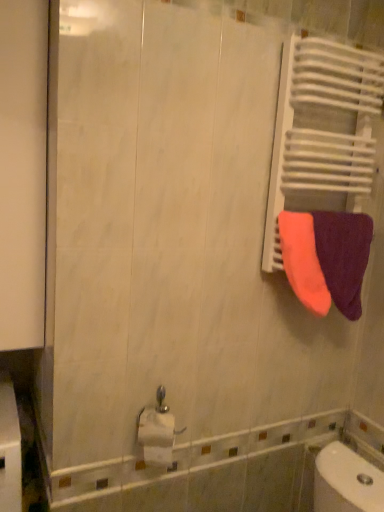
Question: Can you confirm if white glossy toilet paper at lower center is positioned to the right of neon orange fabric at right, which is the 1th towel in left-to-right order?

Choices:
 (A) no
 (B) yes

Answer: (A)

Question: Is white glossy toilet paper at lower center bigger than neon orange fabric at right, which is the 1th towel in left-to-right order?

Choices:
 (A) no
 (B) yes

Answer: (A)

Question: From the image's perspective, would you say white glossy toilet paper at lower center is shown under neon orange fabric at right, positioned as the second towel in right-to-left order?

Choices:
 (A) yes
 (B) no

Answer: (A)

Question: Is white glossy toilet paper at lower center taller than neon orange fabric at right, positioned as the second towel in right-to-left order?

Choices:
 (A) yes
 (B) no

Answer: (B)

Question: Is white glossy toilet paper at lower center positioned far away from neon orange fabric at right, which is the 1th towel in left-to-right order?

Choices:
 (A) yes
 (B) no

Answer: (B)

Question: Is orange terry cloth towel at right, which ranks as the 2th towel in left-to-right order, situated inside neon orange fabric at right, which is the 1th towel in left-to-right order, or outside?

Choices:
 (A) inside
 (B) outside

Answer: (B)

Question: Would you say orange terry cloth towel at right, which ranks as the 1th towel in right-to-left order, is to the left or to the right of neon orange fabric at right, positioned as the second towel in right-to-left order, in the picture?

Choices:
 (A) right
 (B) left

Answer: (A)

Question: Is point (332, 241) closer or farther from the camera than point (289, 230)?

Choices:
 (A) farther
 (B) closer

Answer: (A)

Question: In terms of height, does orange terry cloth towel at right, which ranks as the 2th towel in left-to-right order, look taller or shorter compared to neon orange fabric at right, which is the 1th towel in left-to-right order?

Choices:
 (A) short
 (B) tall

Answer: (B)

Question: Visually, is white glossy toilet paper at lower center positioned to the left or to the right of orange terry cloth towel at right, which ranks as the 2th towel in left-to-right order?

Choices:
 (A) right
 (B) left

Answer: (B)

Question: Considering the positions of white glossy toilet paper at lower center and orange terry cloth towel at right, which ranks as the 2th towel in left-to-right order, in the image, is white glossy toilet paper at lower center bigger or smaller than orange terry cloth towel at right, which ranks as the 2th towel in left-to-right order,?

Choices:
 (A) big
 (B) small

Answer: (B)

Question: Choose the correct answer: Is white glossy toilet paper at lower center inside orange terry cloth towel at right, which ranks as the 1th towel in right-to-left order, or outside it?

Choices:
 (A) outside
 (B) inside

Answer: (A)

Question: Relative to orange terry cloth towel at right, which ranks as the 2th towel in left-to-right order, is white glossy toilet paper at lower center in front or behind?

Choices:
 (A) behind
 (B) front

Answer: (B)

Question: In terms of height, does neon orange fabric at right, which is the 1th towel in left-to-right order, look taller or shorter compared to orange terry cloth towel at right, which ranks as the 1th towel in right-to-left order?

Choices:
 (A) short
 (B) tall

Answer: (A)

Question: Is neon orange fabric at right, positioned as the second towel in right-to-left order, bigger or smaller than orange terry cloth towel at right, which ranks as the 2th towel in left-to-right order?

Choices:
 (A) big
 (B) small

Answer: (B)